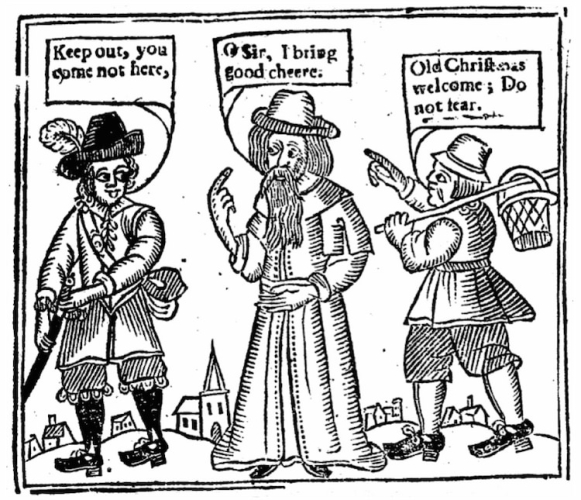
You are a GUI agent. You are given a task and a screenshot of the screen. Output one action in this format:
    pyautogui.click(x=<x>, y=<y>)
    Task: Click on the basket
    The width and height of the screenshot is (581, 500).
    Given the screenshot: What is the action you would take?
    pyautogui.click(x=523, y=220)